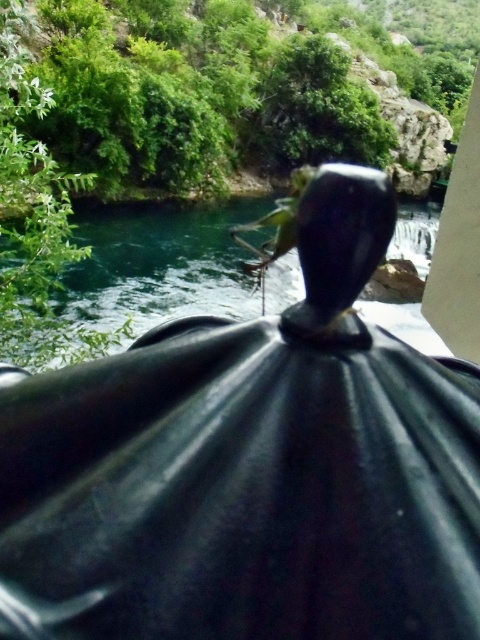
You are standing behind the dark object in the scene and want to reach the green glossy water at center without getting wet. The black glossy umbrella at center is in your path. Can you walk around it to avoid stepping into the water?

The black glossy umbrella at center is positioned under green glossy water at center, so you can walk around the umbrella to avoid stepping into the water.

You are standing behind a dark object with a rounded shape and a black handle at its top. You see a black glossy umbrella at center and a green glossy water at center. Which object is taller?

The green glossy water at center is taller than the black glossy umbrella at center.